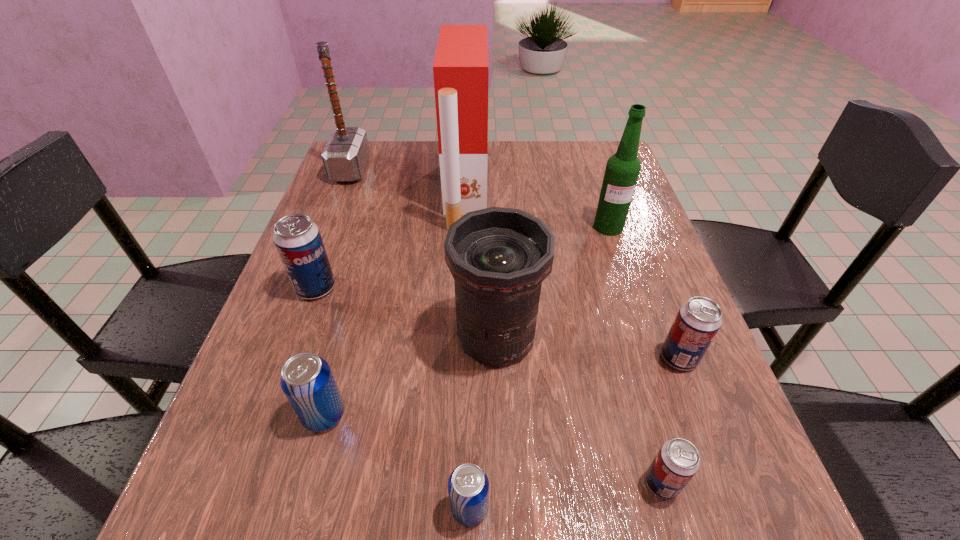
Image resolution: width=960 pixels, height=540 pixels. In order to click on vacant position in the image that satisfies the following two spatial constraints: 1. on the back side of the farthest red beer can; 2. on the striking surface of the hammer in this screenshot , I will do `click(359, 170)`.

The image size is (960, 540). I want to click on vacant space that satisfies the following two spatial constraints: 1. on the front-facing side of the cigarette case; 2. on the back side of the rightmost beer can, so click(460, 357).

The height and width of the screenshot is (540, 960). Find the location of `vacant point that satisfies the following two spatial constraints: 1. on the striking surface of the brown hammer; 2. on the back side of the second red beer can from right to left`. vacant point that satisfies the following two spatial constraints: 1. on the striking surface of the brown hammer; 2. on the back side of the second red beer can from right to left is located at coordinates (229, 483).

Image resolution: width=960 pixels, height=540 pixels. Find the location of `vacant space that satisfies the following two spatial constraints: 1. on the striking surface of the brown hammer; 2. on the back side of the bigger blue beer can`. vacant space that satisfies the following two spatial constraints: 1. on the striking surface of the brown hammer; 2. on the back side of the bigger blue beer can is located at coordinates (255, 415).

Where is `free space that satisfies the following two spatial constraints: 1. on the front-facing side of the nearest red beer can; 2. on the right side of the red cigarette case`? free space that satisfies the following two spatial constraints: 1. on the front-facing side of the nearest red beer can; 2. on the right side of the red cigarette case is located at coordinates (454, 483).